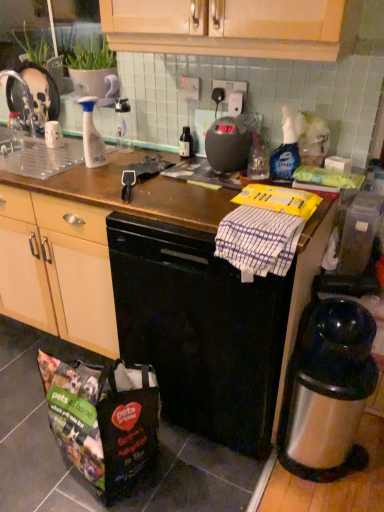
This screenshot has height=512, width=384. I want to click on vacant area situated to the left side of polyester shopping bag at lower left, so click(20, 434).